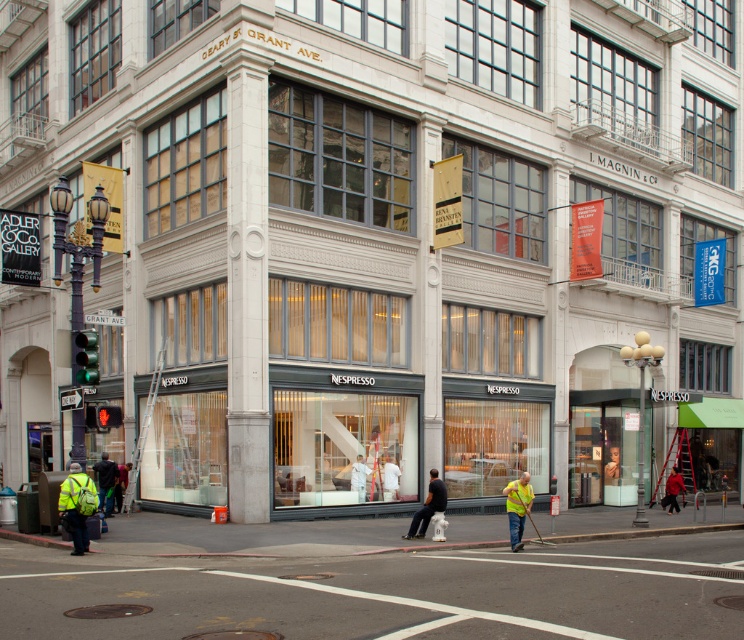
You are standing at the corner of Geary Street and Grant Avenue. You need to cross the street to reach the Nespresso store. Is the smooth asphalt road at center directly in front of you or to your side?

The smooth asphalt road at center is located at point coordinates, so it is directly in front of you. You should proceed carefully across the smooth asphalt road at center to reach the Nespresso store.

You are standing at the corner of Geary Street and Grant Avenue, looking at the Nespresso store. There are two points marked on the building facade. Which point, point (420, 516) or point (670, 502), is closer to you?

Point (420, 516) is closer to the viewer than point (670, 502).